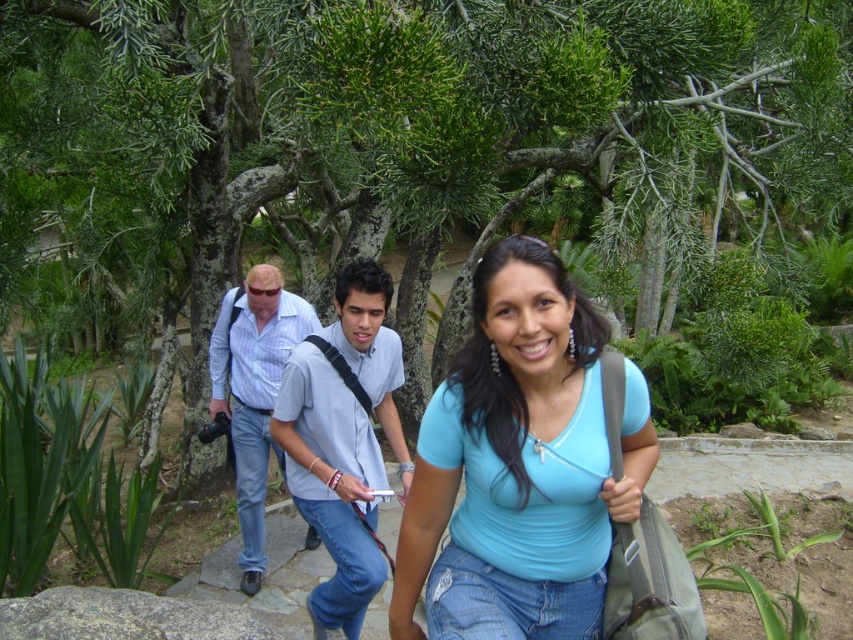
Is blue plaid shirt at center positioned at the back of gray rough rock at lower left?

Yes, it is.

Does blue plaid shirt at center appear on the left side of gray rough rock at lower left?

Correct, you'll find blue plaid shirt at center to the left of gray rough rock at lower left.

Does point (250, 573) come farther from viewer compared to point (227, 604)?

Yes, point (250, 573) is behind point (227, 604).

The image size is (853, 640). Find the location of `blue plaid shirt at center`. blue plaid shirt at center is located at coordinates (254, 392).

Is blue matte shirt at center thinner than light blue shirt at center?

No, blue matte shirt at center is not thinner than light blue shirt at center.

Which is below, blue matte shirt at center or light blue shirt at center?

light blue shirt at center

Is point (538, 340) positioned behind point (276, 422)?

No, (538, 340) is in front of (276, 422).

Where is `blue matte shirt at center`? This screenshot has height=640, width=853. blue matte shirt at center is located at coordinates (518, 465).

Between point (474, 353) and point (96, 632), which one is positioned in front?

Point (474, 353)

Does point (479, 477) lie behind point (195, 620)?

That is False.

This screenshot has height=640, width=853. What are the coordinates of `blue matte shirt at center` in the screenshot? It's located at (518, 465).

This screenshot has width=853, height=640. In order to click on blue matte shirt at center in this screenshot , I will do `click(518, 465)`.